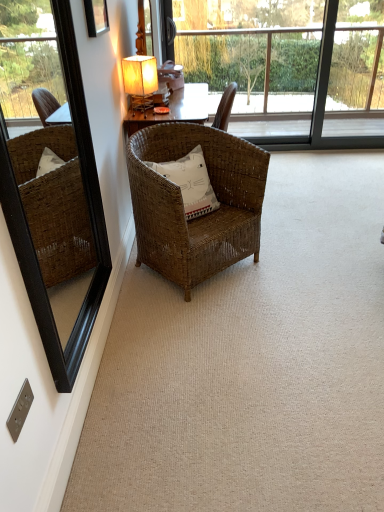
What is the approximate width of black wood mirror at left?

5.20 centimeters.

This screenshot has width=384, height=512. Describe the element at coordinates (190, 182) in the screenshot. I see `white cotton pillow at center` at that location.

At what (x,y) coordinates should I click in order to perform the action: click on white cotton pillow at center. Please return your answer as a coordinate pair (x, y). The height and width of the screenshot is (512, 384). Looking at the image, I should click on (190, 182).

The width and height of the screenshot is (384, 512). What do you see at coordinates (96, 17) in the screenshot? I see `wooden picture frame at upper left` at bounding box center [96, 17].

In the scene shown: What is the approximate height of transparent glass bay window at upper center?

1.32 meters.

Identify the location of black wood mirror at left. (58, 219).

Is woven brown chair at center to the right of black wood mirror at left from the viewer's perspective?

Indeed, woven brown chair at center is positioned on the right side of black wood mirror at left.

Between woven brown chair at center and black wood mirror at left, which one has more height?

Standing taller between the two is black wood mirror at left.

Is woven brown chair at center closer to the viewer compared to black wood mirror at left?

No, woven brown chair at center is further to the viewer.

From the image's perspective, which is above, matte beige fabric table lamp at upper center or transparent glass bay window at upper center?

transparent glass bay window at upper center, from the image's perspective.

Would you say matte beige fabric table lamp at upper center is a long distance from transparent glass bay window at upper center?

Yes, matte beige fabric table lamp at upper center is far from transparent glass bay window at upper center.

I want to click on table lamp on the left of transparent glass bay window at upper center, so click(x=140, y=81).

In the scene shown: Which is closer to the camera, (137,102) or (208,58)?

The point (137,102) is closer to the camera.

Looking at their sizes, would you say white cotton pillow at center is wider or thinner than matte beige fabric table lamp at upper center?

Clearly, white cotton pillow at center has more width compared to matte beige fabric table lamp at upper center.

From the image's perspective, would you say white cotton pillow at center is shown under matte beige fabric table lamp at upper center?

Yes, from the image's perspective, white cotton pillow at center is below matte beige fabric table lamp at upper center.

Is white cotton pillow at center oriented away from matte beige fabric table lamp at upper center?

No.

Consider the image. How different are the orientations of white cotton pillow at center and matte beige fabric table lamp at upper center in degrees?

They differ by 107 degrees in their facing directions.

Is point (200, 206) behind point (215, 153)?

No, it is in front of (215, 153).

Measure the distance from white cotton pillow at center to woven brown chair at center.

7.13 inches.

Which is correct: white cotton pillow at center is inside woven brown chair at center, or outside of it?

white cotton pillow at center is inside woven brown chair at center.

Locate an element on the screen. The image size is (384, 512). chair below the white cotton pillow at center (from a real-world perspective) is located at coordinates (183, 206).

In the scene shown: How different are the orientations of black wood mirror at left and woven brown chair at center in degrees?

There is a 47.3-degree angle between the facing directions of black wood mirror at left and woven brown chair at center.

Which point is more forward, (72, 242) or (178, 212)?

The point (178, 212) is closer.

Which of these two, black wood mirror at left or woven brown chair at center, is thinner?

black wood mirror at left is thinner.

Are black wood mirror at left and woven brown chair at center far apart?

black wood mirror at left is actually quite close to woven brown chair at center.

Is white cotton pillow at center wider or thinner than black wood mirror at left?

Considering their sizes, white cotton pillow at center looks broader than black wood mirror at left.

Considering the sizes of objects white cotton pillow at center and black wood mirror at left in the image provided, who is bigger, white cotton pillow at center or black wood mirror at left?

With larger size is black wood mirror at left.

Is white cotton pillow at center far from black wood mirror at left?

white cotton pillow at center is actually quite close to black wood mirror at left.

Is white cotton pillow at center facing away from black wood mirror at left?

white cotton pillow at center does not have its back to black wood mirror at left.

Can you confirm if transparent glass bay window at upper center is shorter than white cotton pillow at center?

No.

Based on their sizes in the image, would you say transparent glass bay window at upper center is bigger or smaller than white cotton pillow at center?

Considering their sizes, transparent glass bay window at upper center takes up more space than white cotton pillow at center.

From a real-world perspective, is transparent glass bay window at upper center physically below white cotton pillow at center?

No, from a real-world perspective, transparent glass bay window at upper center is not beneath white cotton pillow at center.

Identify the location of window frame located on the left of woven brown chair at center. This screenshot has height=512, width=384. (58, 219).

What are the coordinates of `bay window above the matte beige fabric table lamp at upper center (from the image's perspective)` in the screenshot? It's located at 287,66.

When comparing their distances from black wood mirror at left, does white cotton pillow at center or transparent glass bay window at upper center seem further?

Among the two, transparent glass bay window at upper center is located further to black wood mirror at left.

From the image, which object appears to be farther from transparent glass bay window at upper center, white cotton pillow at center or woven brown chair at center?

The object further to transparent glass bay window at upper center is white cotton pillow at center.

From the image, which object appears to be nearer to matte beige fabric table lamp at upper center, transparent glass bay window at upper center or woven brown chair at center?

woven brown chair at center lies closer to matte beige fabric table lamp at upper center than the other object.

From the image, which object appears to be nearer to black wood mirror at left, white cotton pillow at center or matte beige fabric table lamp at upper center?

Based on the image, white cotton pillow at center appears to be nearer to black wood mirror at left.

Looking at the image, which one is located further to transparent glass bay window at upper center, matte beige fabric table lamp at upper center or black wood mirror at left?

Among the two, black wood mirror at left is located further to transparent glass bay window at upper center.

Based on their spatial positions, is wooden picture frame at upper left or black wood mirror at left further from transparent glass bay window at upper center?

The object further to transparent glass bay window at upper center is black wood mirror at left.

Looking at the image, which one is located further to transparent glass bay window at upper center, white cotton pillow at center or wooden picture frame at upper left?

wooden picture frame at upper left.

From the image, which object appears to be nearer to wooden picture frame at upper left, transparent glass bay window at upper center or matte beige fabric table lamp at upper center?

matte beige fabric table lamp at upper center is positioned closer to the anchor wooden picture frame at upper left.

At what (x,y) coordinates should I click in order to perform the action: click on pillow between woven brown chair at center and transparent glass bay window at upper center along the z-axis. Please return your answer as a coordinate pair (x, y). The height and width of the screenshot is (512, 384). Looking at the image, I should click on pyautogui.click(x=190, y=182).

The width and height of the screenshot is (384, 512). Find the location of `table lamp between white cotton pillow at center and transparent glass bay window at upper center in the front-back direction`. table lamp between white cotton pillow at center and transparent glass bay window at upper center in the front-back direction is located at coordinates (140, 81).

Locate an element on the screen. The width and height of the screenshot is (384, 512). pillow between wooden picture frame at upper left and transparent glass bay window at upper center in the front-back direction is located at coordinates (190, 182).

Identify the location of pillow that lies between matte beige fabric table lamp at upper center and woven brown chair at center from top to bottom. (190, 182).